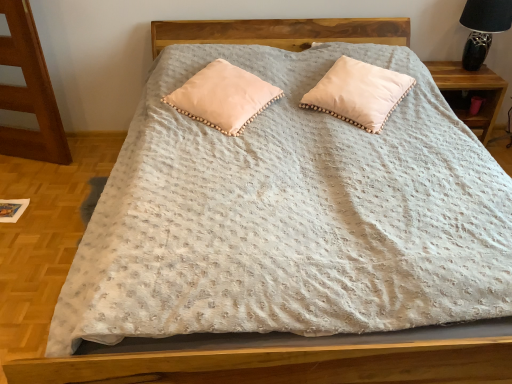
Question: In terms of size, does wooden nightstand at right appear bigger or smaller than black ceramic table lamp at upper right?

Choices:
 (A) big
 (B) small

Answer: (A)

Question: From a real-world perspective, relative to black ceramic table lamp at upper right, is wooden nightstand at right vertically above or below?

Choices:
 (A) above
 (B) below

Answer: (B)

Question: Estimate the real-world distances between objects in this image. Which object is farther from the black ceramic table lamp at upper right?

Choices:
 (A) peachy soft pillow at center, the first pillow positioned from the left
 (B) wooden nightstand at right
 (C) peachy soft pillow at upper center, arranged as the first pillow when viewed from the right

Answer: (A)

Question: Which object is the farthest from the black ceramic table lamp at upper right?

Choices:
 (A) peachy soft pillow at upper center, arranged as the first pillow when viewed from the right
 (B) wooden nightstand at right
 (C) peachy soft pillow at center, the first pillow positioned from the left

Answer: (C)